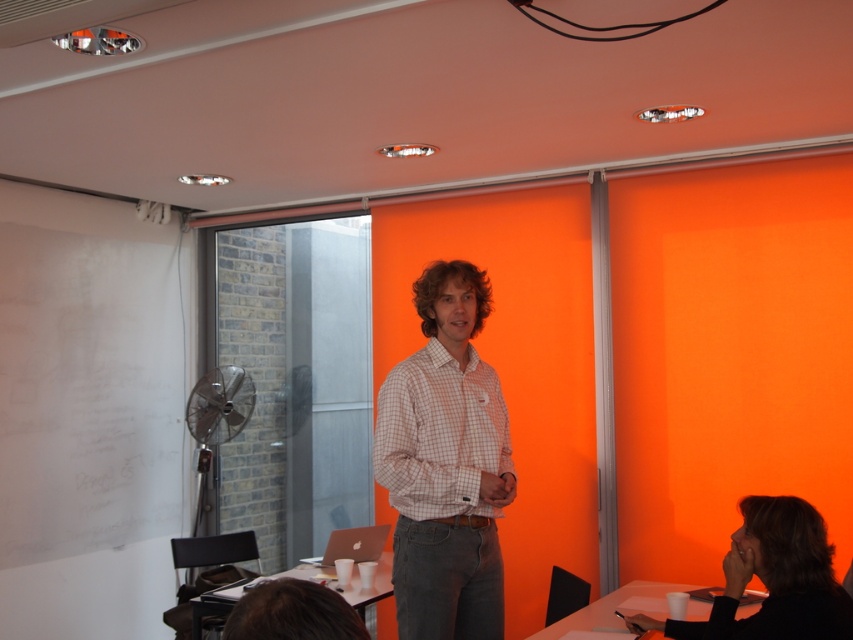
Question: Considering the relative positions of checkered fabric shirt at center and black fabric hair at lower right in the image provided, where is checkered fabric shirt at center located with respect to black fabric hair at lower right?

Choices:
 (A) above
 (B) below

Answer: (A)

Question: Is checkered fabric shirt at center thinner than black fabric hair at lower right?

Choices:
 (A) no
 (B) yes

Answer: (B)

Question: Which point is farther to the camera?

Choices:
 (A) checkered fabric shirt at center
 (B) black fabric hair at lower right

Answer: (A)

Question: Is checkered fabric shirt at center below black fabric hair at lower right?

Choices:
 (A) no
 (B) yes

Answer: (A)

Question: Which of the following is the closest to the observer?

Choices:
 (A) checkered fabric shirt at center
 (B) black fabric hair at lower right

Answer: (B)